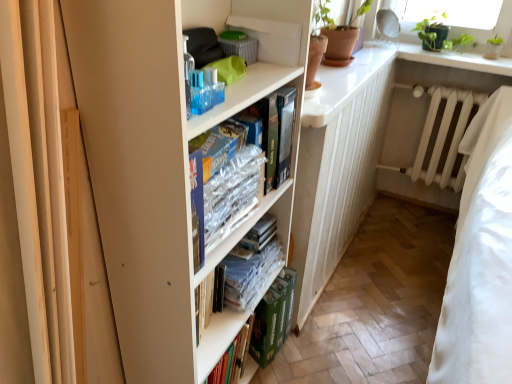
Question: Does white glossy counter top at upper right have a smaller size compared to clear plastic books at center, which appears as the 2th book when viewed from the top?

Choices:
 (A) no
 (B) yes

Answer: (A)

Question: Considering the relative sizes of white glossy counter top at upper right and clear plastic books at center, which appears as the 2th book when viewed from the top, in the image provided, is white glossy counter top at upper right bigger than clear plastic books at center, which appears as the 2th book when viewed from the top,?

Choices:
 (A) yes
 (B) no

Answer: (A)

Question: Does white glossy counter top at upper right have a lesser height compared to clear plastic books at center, which appears as the 2th book when viewed from the top?

Choices:
 (A) yes
 (B) no

Answer: (A)

Question: Considering the relative sizes of white glossy counter top at upper right and clear plastic books at center, which ranks as the first book in bottom-to-top order, in the image provided, is white glossy counter top at upper right taller than clear plastic books at center, which ranks as the first book in bottom-to-top order,?

Choices:
 (A) no
 (B) yes

Answer: (A)

Question: Is white glossy counter top at upper right wider than clear plastic books at center, which appears as the 2th book when viewed from the top?

Choices:
 (A) no
 (B) yes

Answer: (B)

Question: Considering their positions, is white matte bookcase at center located in front of or behind white matte radiator at center?

Choices:
 (A) front
 (B) behind

Answer: (A)

Question: From a real-world perspective, relative to white matte radiator at center, is white matte bookcase at center vertically above or below?

Choices:
 (A) below
 (B) above

Answer: (B)

Question: Is white matte bookcase at center to the left or to the right of white matte radiator at center in the image?

Choices:
 (A) left
 (B) right

Answer: (A)

Question: From their relative heights in the image, would you say white matte bookcase at center is taller or shorter than white matte radiator at center?

Choices:
 (A) tall
 (B) short

Answer: (A)

Question: Considering the positions of point (440, 86) and point (258, 288), is point (440, 86) closer or farther from the camera than point (258, 288)?

Choices:
 (A) farther
 (B) closer

Answer: (A)

Question: Is white matte radiator at center inside the boundaries of clear plastic books at center, which appears as the 2th book when viewed from the top, or outside?

Choices:
 (A) inside
 (B) outside

Answer: (B)

Question: From the image's perspective, is white matte radiator at center above or below clear plastic books at center, which ranks as the first book in bottom-to-top order?

Choices:
 (A) below
 (B) above

Answer: (B)

Question: Considering the positions of white matte radiator at center and clear plastic books at center, which appears as the 2th book when viewed from the top, in the image, is white matte radiator at center wider or thinner than clear plastic books at center, which appears as the 2th book when viewed from the top,?

Choices:
 (A) wide
 (B) thin

Answer: (B)

Question: From the image's perspective, is white glossy counter top at upper right located above or below white matte bookcase at center?

Choices:
 (A) below
 (B) above

Answer: (B)

Question: Choose the correct answer: Is white glossy counter top at upper right inside white matte bookcase at center or outside it?

Choices:
 (A) outside
 (B) inside

Answer: (A)